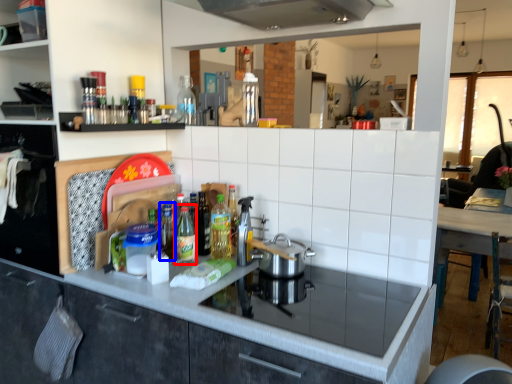
Question: Which object appears farthest to the camera in this image, bottle (highlighted by a red box) or bottle (highlighted by a blue box)?

Choices:
 (A) bottle
 (B) bottle

Answer: (B)